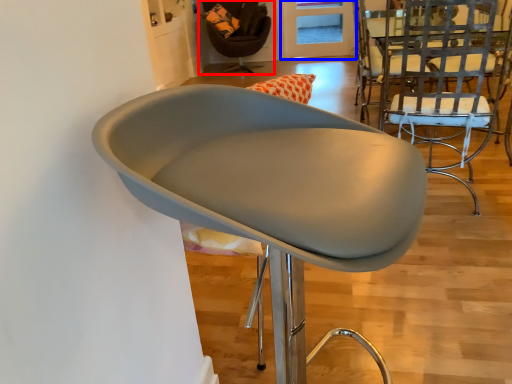
Question: Which point is further to the camera, chair (highlighted by a red box) or glass door (highlighted by a blue box)?

Choices:
 (A) chair
 (B) glass door

Answer: (B)